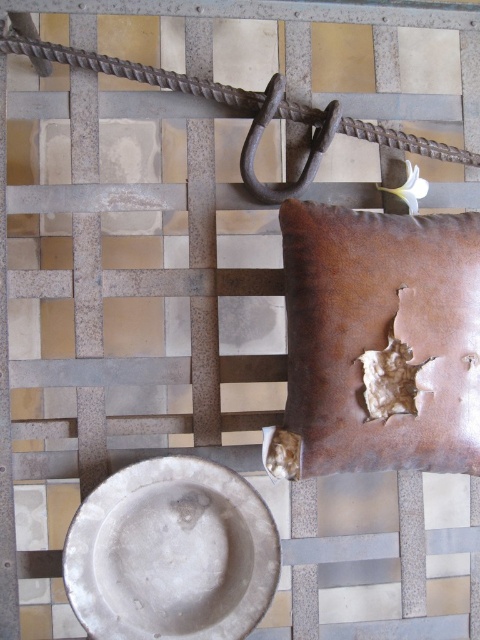
You are standing in a room with a textured tile floor. You see a metal hook in the upper part of the image and a metallic bowl in the lower left corner. There is also a point marked at coordinates (171, 554). What object is located at that point?

The point at coordinates (171, 554) indicates the matte silver plate at center.

You are an observer looking at the textured tile surface. There is a rusty metal rope at upper center and a rusty metal hook at center. Which object is positioned to the left of the other?

The rusty metal rope at upper center is to the left of the rusty metal hook at center.